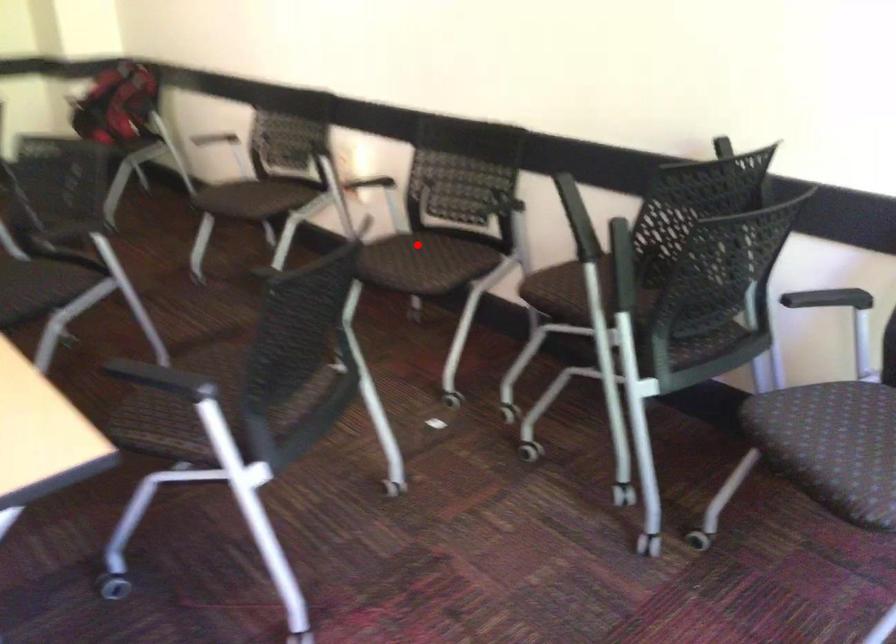
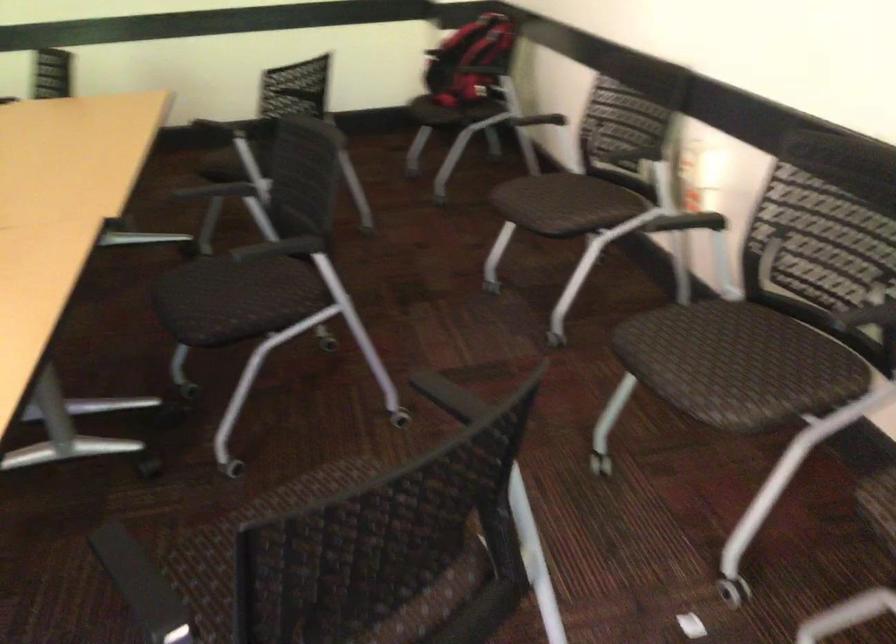
In the second image, find the point that corresponds to the highlighted location in the first image.

(735, 335)